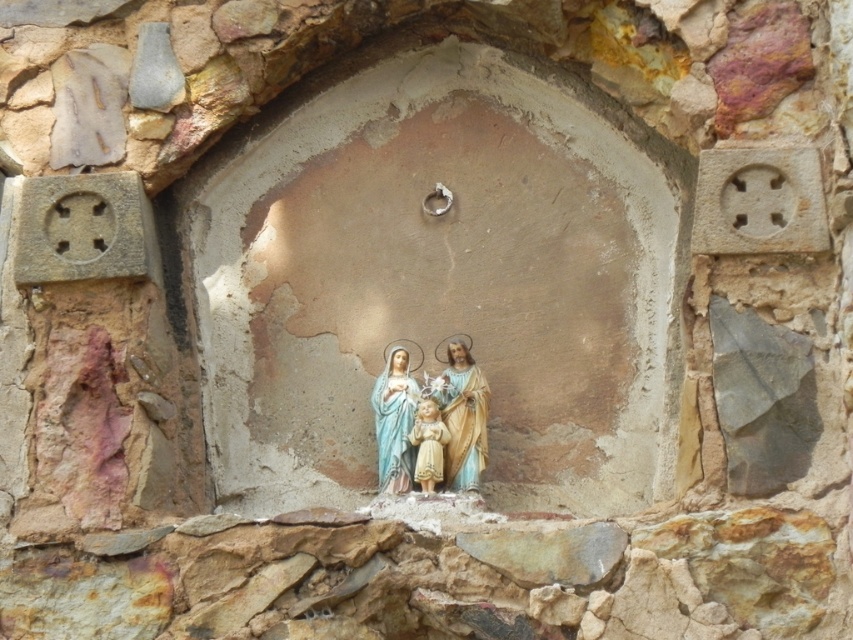
Question: Which point appears farthest from the camera in this image?

Choices:
 (A) (399, 424)
 (B) (447, 346)
 (C) (431, 449)

Answer: (B)

Question: Can you confirm if matte porcelain holy family at center is positioned to the left of smooth beige figurine at center?

Choices:
 (A) yes
 (B) no

Answer: (A)

Question: Which of the following is the closest to the observer?

Choices:
 (A) (384, 461)
 (B) (444, 480)

Answer: (B)

Question: Is matte porcelain holy family at center bigger than smooth beige figurine at center?

Choices:
 (A) no
 (B) yes

Answer: (B)

Question: Is matte plastic statue at center to the left of matte porcelain holy family at center from the viewer's perspective?

Choices:
 (A) no
 (B) yes

Answer: (A)

Question: Which object is closer to the camera taking this photo?

Choices:
 (A) smooth beige figurine at center
 (B) matte porcelain holy family at center

Answer: (A)